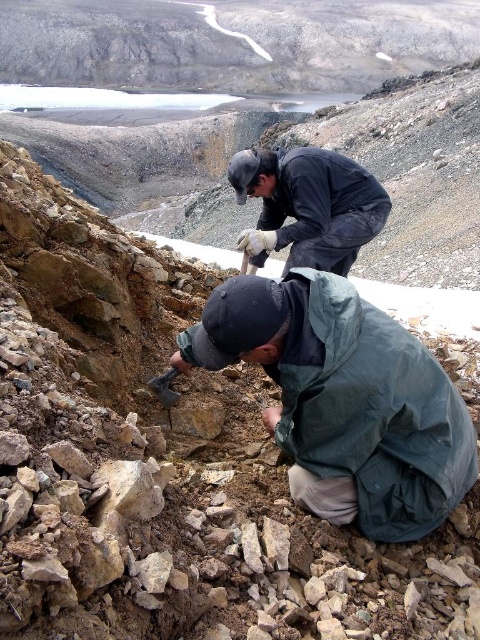
Question: Does green fabric jacket at lower right have a smaller size compared to black matte jacket at upper center?

Choices:
 (A) yes
 (B) no

Answer: (A)

Question: Is green fabric jacket at lower right to the left of black matte jacket at upper center from the viewer's perspective?

Choices:
 (A) yes
 (B) no

Answer: (B)

Question: Among these points, which one is nearest to the camera?

Choices:
 (A) (316, 243)
 (B) (435, 497)

Answer: (B)

Question: Can you confirm if green fabric jacket at lower right is positioned to the right of black matte jacket at upper center?

Choices:
 (A) yes
 (B) no

Answer: (A)

Question: Which of the following is the closest to the observer?

Choices:
 (A) black matte jacket at upper center
 (B) green fabric jacket at lower right

Answer: (B)